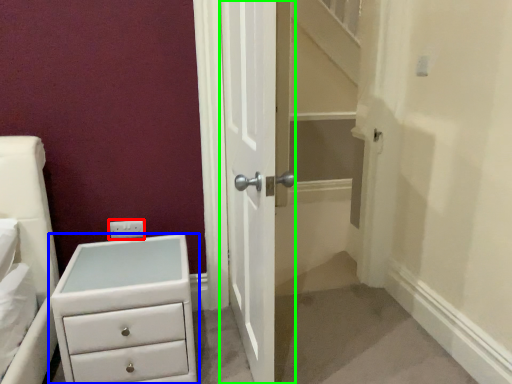
Question: Based on their relative distances, which object is nearer to electric outlet (highlighted by a red box)? Choose from chest of drawers (highlighted by a blue box) and door (highlighted by a green box).

Choices:
 (A) chest of drawers
 (B) door

Answer: (A)